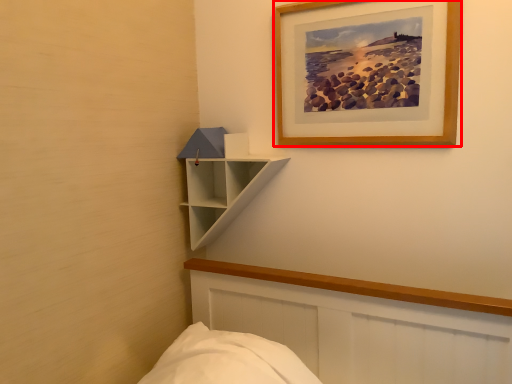
Question: In this image, where is picture frame (annotated by the red box) located relative to shelf?

Choices:
 (A) left
 (B) right

Answer: (B)